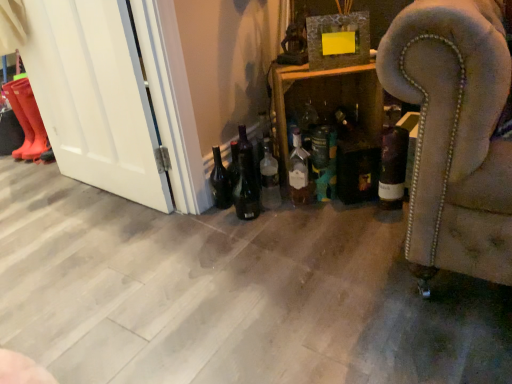
The image size is (512, 384). Identify the location of vacant space situated on the left part of black glass beer bottle at lower center, which ranks as the second beer bottle in left-to-right order. (208, 225).